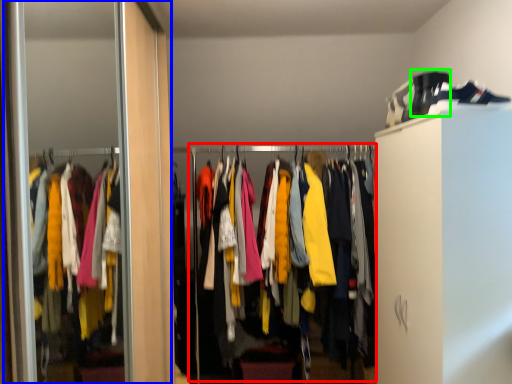
Question: Considering the real-world distances, which object is closest to closet (highlighted by a red box)? screen door (highlighted by a blue box) or shoe (highlighted by a green box).

Choices:
 (A) screen door
 (B) shoe

Answer: (B)